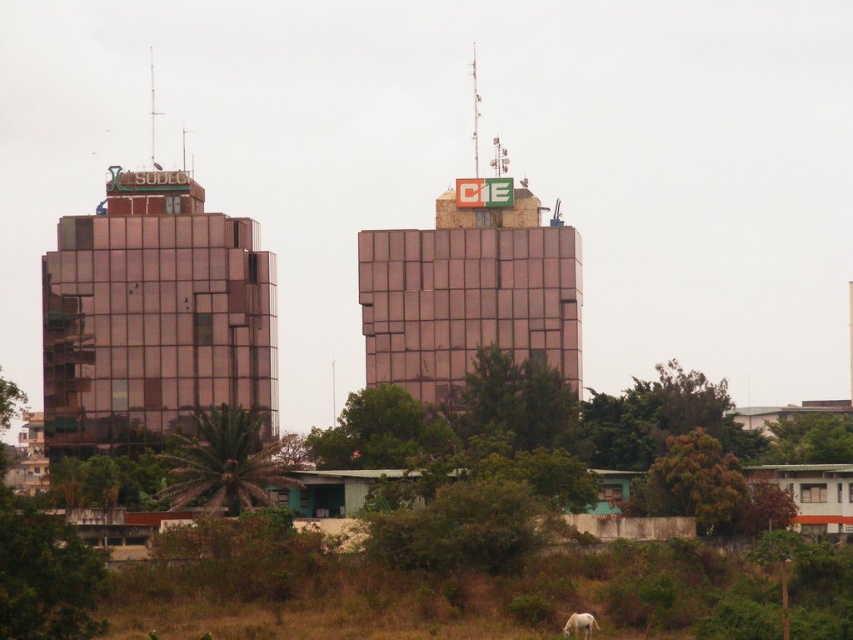
Question: Can you confirm if matte glass building at left is positioned to the right of white matte horse at lower right?

Choices:
 (A) yes
 (B) no

Answer: (B)

Question: Is metallic glass building at center to the right of white matte horse at lower right from the viewer's perspective?

Choices:
 (A) yes
 (B) no

Answer: (B)

Question: Which of these objects is positioned closest to the matte glass building at left?

Choices:
 (A) metallic glass building at center
 (B) white matte horse at lower right

Answer: (A)

Question: Can you confirm if metallic glass building at center is positioned to the left of white matte horse at lower right?

Choices:
 (A) no
 (B) yes

Answer: (B)

Question: Estimate the real-world distances between objects in this image. Which object is closer to the matte glass building at left?

Choices:
 (A) metallic glass building at center
 (B) white matte horse at lower right

Answer: (A)

Question: Among these objects, which one is farthest from the camera?

Choices:
 (A) matte glass building at left
 (B) metallic glass building at center
 (C) white matte horse at lower right

Answer: (A)